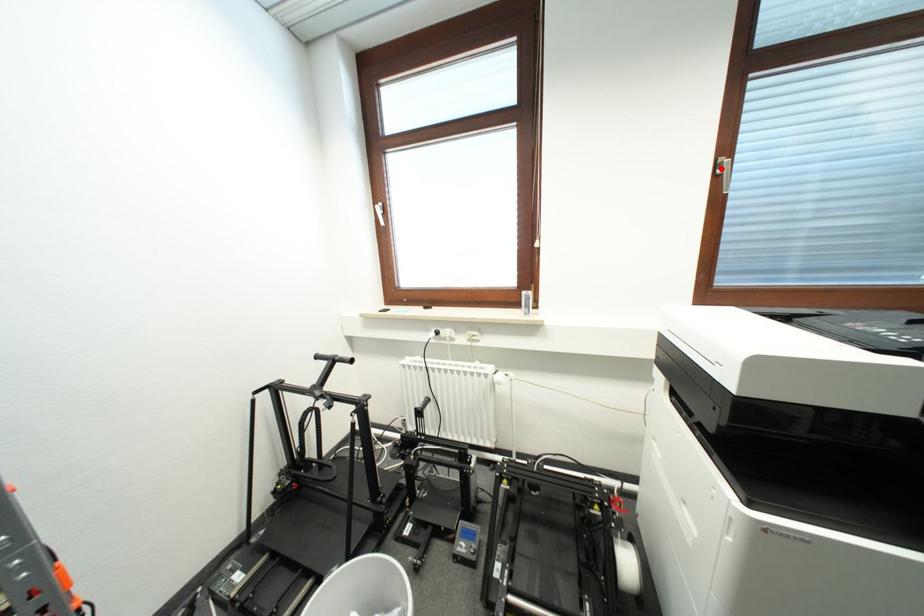
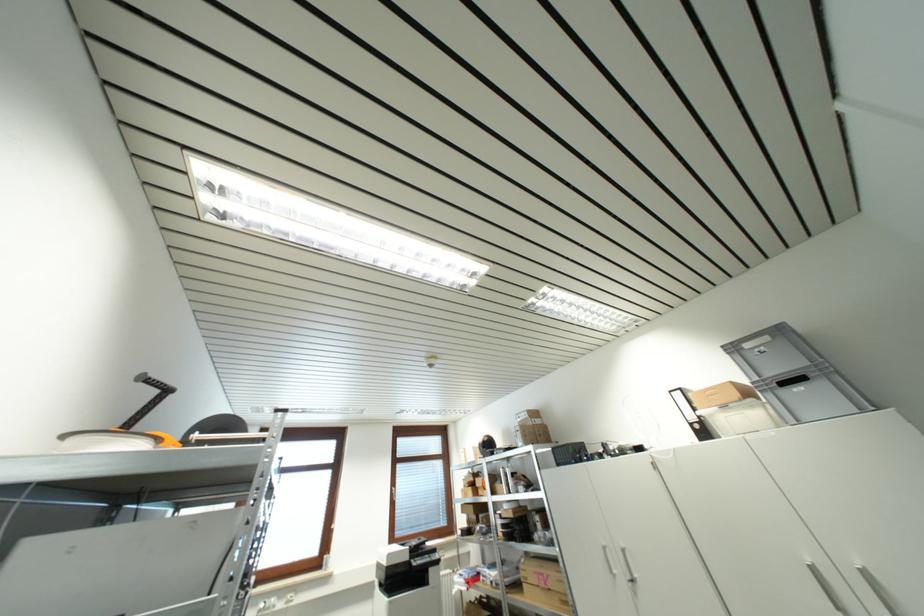
Question: I am providing you with two images of the same scene from different viewpoints. Image1 has a red point marked. In image2, the corresponding 3D location appears at what relative position? Reply with the corresponding letter.

Choices:
 (A) Closer
 (B) Farther

Answer: (B)